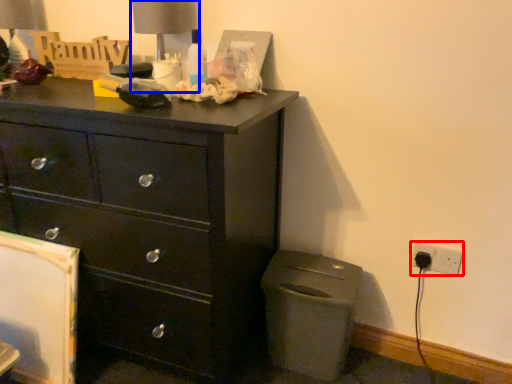
Question: Which object is closer to the camera taking this photo, electric outlet (highlighted by a red box) or table lamp (highlighted by a blue box)?

Choices:
 (A) electric outlet
 (B) table lamp

Answer: (B)